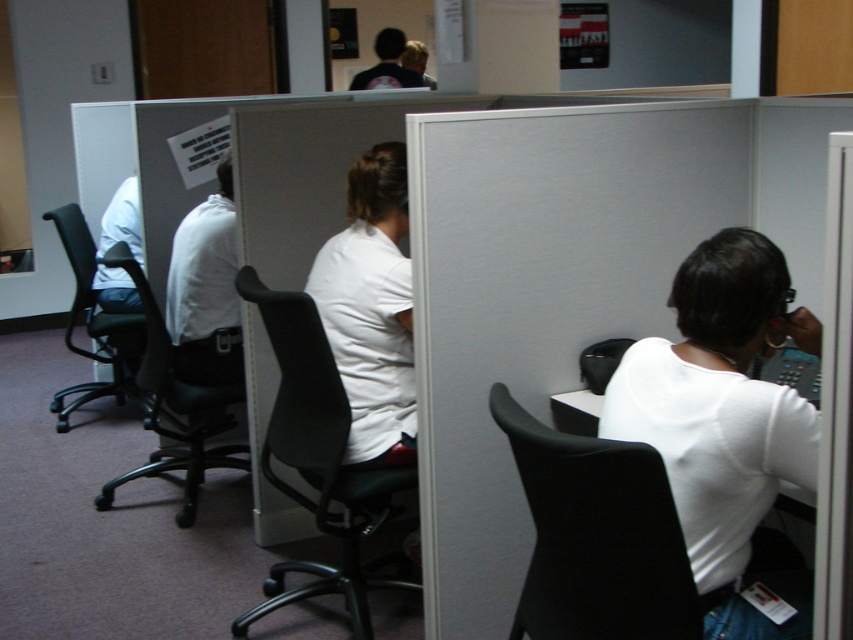
Which of these two, white matte shirt at right or black matte swivel chair at lower right, stands shorter?

black matte swivel chair at lower right

Can you confirm if white matte shirt at right is wider than black matte swivel chair at lower right?

Indeed, white matte shirt at right has a greater width compared to black matte swivel chair at lower right.

At what (x,y) coordinates should I click in order to perform the action: click on white matte shirt at right. Please return your answer as a coordinate pair (x, y). The height and width of the screenshot is (640, 853). Looking at the image, I should click on (724, 420).

Between point (663, 458) and point (291, 406), which one is positioned behind?

Positioned behind is point (291, 406).

Can you confirm if white matte shirt at right is bigger than black leather swivel chair at center?

No.

Who is more distant from viewer, (780,396) or (294,596)?

Point (294,596)

At what (x,y) coordinates should I click in order to perform the action: click on white matte shirt at right. Please return your answer as a coordinate pair (x, y). The height and width of the screenshot is (640, 853). Looking at the image, I should click on (724, 420).

Can you confirm if black matte swivel chair at lower right is positioned to the right of black leather swivel chair at left?

Indeed, black matte swivel chair at lower right is positioned on the right side of black leather swivel chair at left.

The height and width of the screenshot is (640, 853). What do you see at coordinates (596, 536) in the screenshot?
I see `black matte swivel chair at lower right` at bounding box center [596, 536].

Where is `black matte swivel chair at lower right`? black matte swivel chair at lower right is located at coordinates (596, 536).